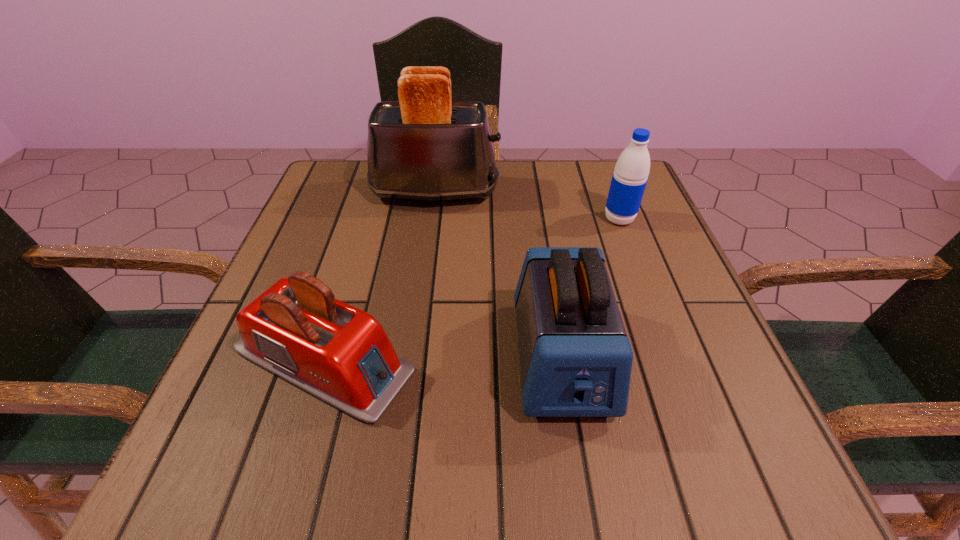
This screenshot has width=960, height=540. Find the location of `object that stands as the second closest to the farthest toaster`. object that stands as the second closest to the farthest toaster is located at coordinates (575, 357).

Where is `toaster that is the nearest to the rightmost toaster`? toaster that is the nearest to the rightmost toaster is located at coordinates (296, 329).

Choose which toaster is the second nearest neighbor to the tallest object. Please provide its 2D coordinates. Your answer should be formatted as a tuple, i.e. [(x, y)], where the tuple contains the x and y coordinates of a point satisfying the conditions above.

[(296, 329)]

The height and width of the screenshot is (540, 960). In order to click on free location that satisfies the following two spatial constraints: 1. on the side of the farthest toaster with the control lever; 2. on the right side of the rightmost object in this screenshot , I will do `click(431, 219)`.

Locate an element on the screen. free space in the image that satisfies the following two spatial constraints: 1. on the side of the tallest object with the control lever; 2. on the right side of the rightmost object is located at coordinates pos(431,219).

Locate an element on the screen. free space that satisfies the following two spatial constraints: 1. on the side of the water bottle with the control lever; 2. on the left side of the farthest toaster is located at coordinates (431, 219).

This screenshot has height=540, width=960. What are the coordinates of `free space that satisfies the following two spatial constraints: 1. on the side of the tallest object with the control lever; 2. on the front side of the shortest object` in the screenshot? It's located at (413, 360).

Locate an element on the screen. This screenshot has width=960, height=540. free space that satisfies the following two spatial constraints: 1. on the side of the tallest object with the control lever; 2. on the back side of the water bottle is located at coordinates (431, 219).